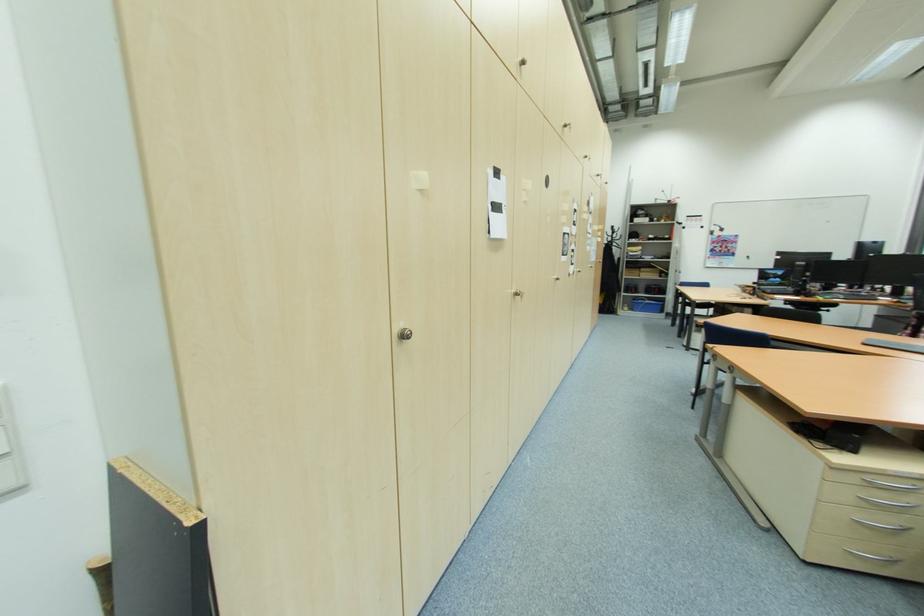
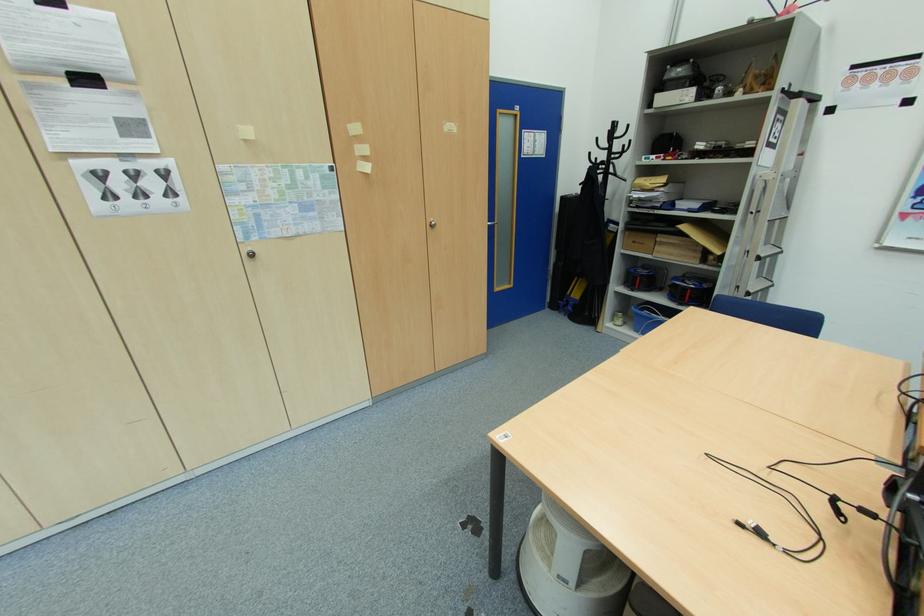
Where in the second image is the point corresponding to (x=643, y=268) from the first image?

(660, 233)